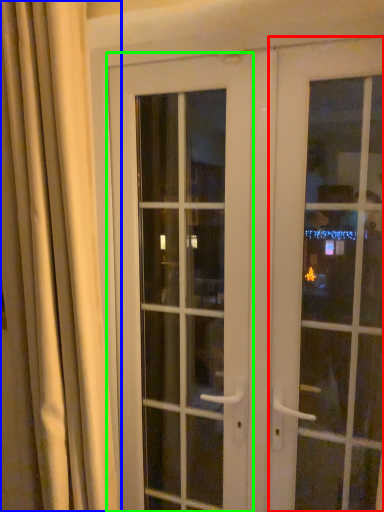
Question: Which is farther away from door (highlighted by a red box)? curtain (highlighted by a blue box) or door (highlighted by a green box)?

Choices:
 (A) curtain
 (B) door

Answer: (A)